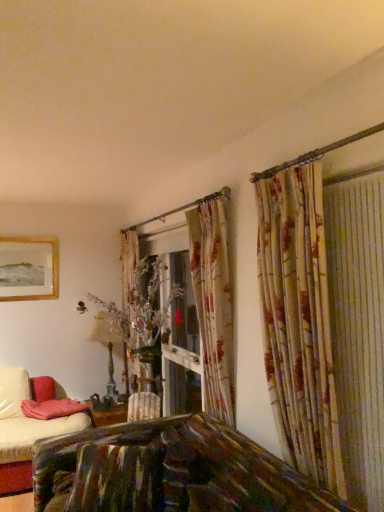
Question: Considering the relative sizes of wooden framed picture at upper left and antique brass table lamp at center in the image provided, is wooden framed picture at upper left bigger than antique brass table lamp at center?

Choices:
 (A) yes
 (B) no

Answer: (B)

Question: Would you say wooden framed picture at upper left is outside antique brass table lamp at center?

Choices:
 (A) yes
 (B) no

Answer: (A)

Question: Is wooden framed picture at upper left beside antique brass table lamp at center?

Choices:
 (A) yes
 (B) no

Answer: (B)

Question: Is wooden framed picture at upper left smaller than antique brass table lamp at center?

Choices:
 (A) yes
 (B) no

Answer: (A)

Question: Is wooden framed picture at upper left thinner than antique brass table lamp at center?

Choices:
 (A) yes
 (B) no

Answer: (A)

Question: From the image's perspective, relative to antique brass table lamp at center, is wooden framed picture at upper left above or below?

Choices:
 (A) above
 (B) below

Answer: (A)

Question: Considering the positions of wooden framed picture at upper left and antique brass table lamp at center in the image, is wooden framed picture at upper left taller or shorter than antique brass table lamp at center?

Choices:
 (A) tall
 (B) short

Answer: (B)

Question: From a real-world perspective, is wooden framed picture at upper left positioned above or below antique brass table lamp at center?

Choices:
 (A) below
 (B) above

Answer: (B)

Question: Would you say wooden framed picture at upper left is to the left or to the right of antique brass table lamp at center in the picture?

Choices:
 (A) right
 (B) left

Answer: (B)

Question: In the image, is wooden framed picture at upper left on the left side or the right side of pink fabric pillow at lower left?

Choices:
 (A) left
 (B) right

Answer: (A)

Question: Is wooden framed picture at upper left taller or shorter than pink fabric pillow at lower left?

Choices:
 (A) tall
 (B) short

Answer: (A)

Question: Is point tap(11, 267) closer or farther from the camera than point tap(56, 415)?

Choices:
 (A) farther
 (B) closer

Answer: (A)

Question: Considering the positions of wooden framed picture at upper left and pink fabric pillow at lower left in the image, is wooden framed picture at upper left bigger or smaller than pink fabric pillow at lower left?

Choices:
 (A) big
 (B) small

Answer: (B)

Question: From the image's perspective, is antique brass table lamp at center positioned above or below wooden framed picture at upper left?

Choices:
 (A) below
 (B) above

Answer: (A)

Question: Based on their positions, is antique brass table lamp at center located to the left or right of wooden framed picture at upper left?

Choices:
 (A) right
 (B) left

Answer: (A)